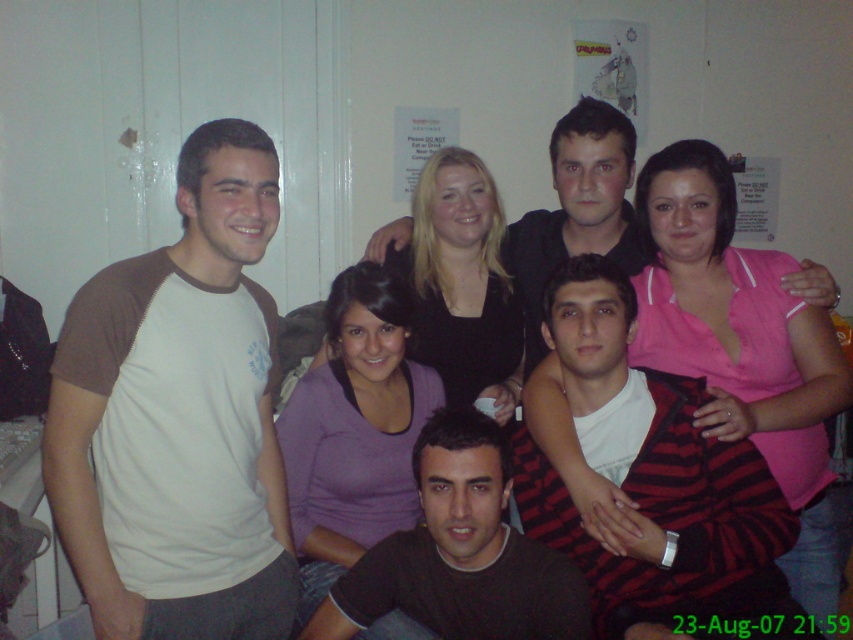
Who is taller, pink cotton shirt at center or dark brown t-shirt at center?

Standing taller between the two is pink cotton shirt at center.

How far apart are pink cotton shirt at center and dark brown t-shirt at center?

20.84 inches

The image size is (853, 640). What do you see at coordinates (741, 348) in the screenshot? I see `pink cotton shirt at center` at bounding box center [741, 348].

You are a GUI agent. You are given a task and a screenshot of the screen. Output one action in this format:
    pyautogui.click(x=<x>, y=<y>)
    Task: Click on the pink cotton shirt at center
    
    Given the screenshot: What is the action you would take?
    pyautogui.click(x=741, y=348)

Is purple soft fabric shirt at center wider than matte black shirt at center?

A: Yes, purple soft fabric shirt at center is wider than matte black shirt at center.

This screenshot has height=640, width=853. What do you see at coordinates (354, 429) in the screenshot?
I see `purple soft fabric shirt at center` at bounding box center [354, 429].

In order to click on purple soft fabric shirt at center in this screenshot , I will do `click(354, 429)`.

Who is lower down, striped sweater at center or black matte shirt at center?

striped sweater at center is below.

Who is higher up, striped sweater at center or black matte shirt at center?

black matte shirt at center is higher up.

Is point (741, 496) farther from viewer compared to point (457, 291)?

No, (741, 496) is closer to viewer.

The width and height of the screenshot is (853, 640). What are the coordinates of `striped sweater at center` in the screenshot? It's located at (656, 481).